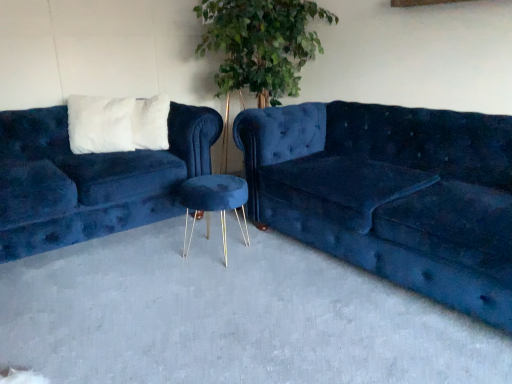
Question: Is velvet blue couch at center, marked as the second studio couch in a left-to-right arrangement, positioned beyond the bounds of blue velvet stool at center?

Choices:
 (A) yes
 (B) no

Answer: (A)

Question: Is velvet blue couch at center, marked as the second studio couch in a left-to-right arrangement, at the right side of blue velvet stool at center?

Choices:
 (A) no
 (B) yes

Answer: (B)

Question: From a real-world perspective, is velvet blue couch at center, which ranks as the 1th studio couch in right-to-left order, under blue velvet stool at center?

Choices:
 (A) yes
 (B) no

Answer: (B)

Question: From the image's perspective, is velvet blue couch at center, marked as the second studio couch in a left-to-right arrangement, beneath blue velvet stool at center?

Choices:
 (A) yes
 (B) no

Answer: (B)

Question: Is velvet blue couch at center, which ranks as the 1th studio couch in right-to-left order, wider than blue velvet stool at center?

Choices:
 (A) no
 (B) yes

Answer: (A)

Question: From a real-world perspective, relative to blue velvet stool at center, is velvet blue stool at center vertically above or below?

Choices:
 (A) above
 (B) below

Answer: (A)

Question: Relative to blue velvet stool at center, is velvet blue stool at center in front or behind?

Choices:
 (A) front
 (B) behind

Answer: (B)

Question: Which is correct: velvet blue stool at center is inside blue velvet stool at center, or outside of it?

Choices:
 (A) inside
 (B) outside

Answer: (B)

Question: From their relative heights in the image, would you say velvet blue stool at center is taller or shorter than blue velvet stool at center?

Choices:
 (A) tall
 (B) short

Answer: (A)

Question: Is blue velvet stool at center to the left or to the right of velvet blue couch at left, which ranks as the first studio couch in left-to-right order, in the image?

Choices:
 (A) right
 (B) left

Answer: (A)

Question: Considering their positions, is blue velvet stool at center located in front of or behind velvet blue couch at left, marked as the 2th studio couch in a right-to-left arrangement?

Choices:
 (A) front
 (B) behind

Answer: (A)

Question: From a real-world perspective, is blue velvet stool at center physically located above or below velvet blue couch at left, which ranks as the first studio couch in left-to-right order?

Choices:
 (A) above
 (B) below

Answer: (B)

Question: Is point (145, 327) closer or farther from the camera than point (44, 221)?

Choices:
 (A) farther
 (B) closer

Answer: (B)

Question: Looking at their shapes, would you say blue velvet stool at center is wider or thinner than velvet blue stool at center?

Choices:
 (A) thin
 (B) wide

Answer: (B)

Question: In the image, is blue velvet stool at center positioned in front of or behind velvet blue stool at center?

Choices:
 (A) front
 (B) behind

Answer: (A)